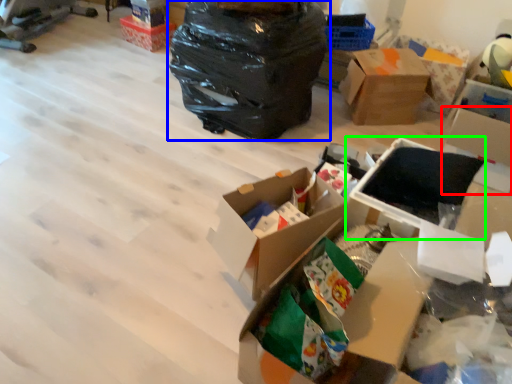
Question: Which object is the farthest from storage box (highlighted by a red box)? Choose among these: plastic bag (highlighted by a blue box) or storage box (highlighted by a green box).

Choices:
 (A) plastic bag
 (B) storage box

Answer: (A)